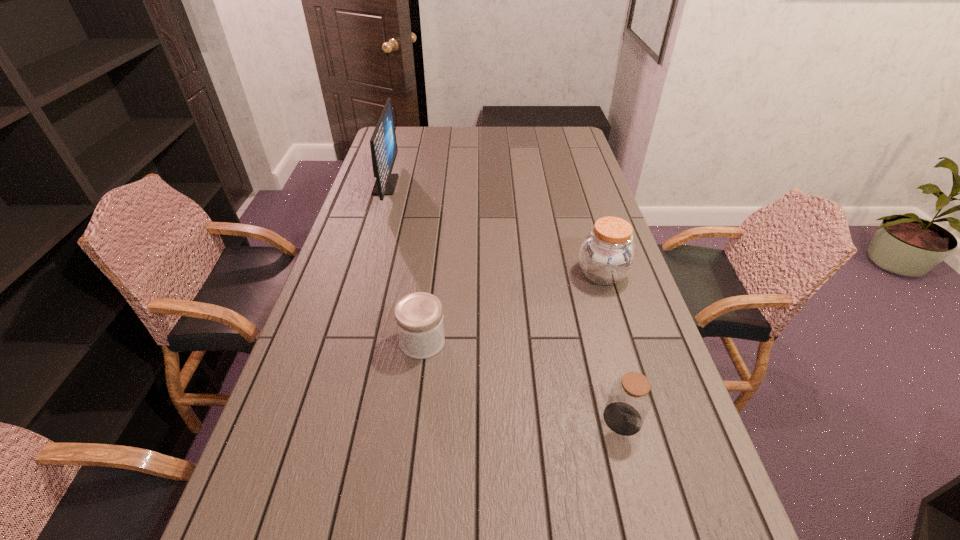
I want to click on blank space that satisfies the following two spatial constraints: 1. on the back side of the nearest object; 2. on the screen side of the leftmost object, so click(x=561, y=185).

This screenshot has height=540, width=960. I want to click on free point that satisfies the following two spatial constraints: 1. on the screen side of the farthest object; 2. on the back side of the leftmost jar, so click(338, 342).

This screenshot has width=960, height=540. Identify the location of blank area in the image that satisfies the following two spatial constraints: 1. on the screen side of the second nearest jar; 2. on the right side of the farthest object. (338, 342).

Where is `free point that satisfies the following two spatial constraints: 1. on the back side of the second farthest jar; 2. on the screen side of the tallest object`? free point that satisfies the following two spatial constraints: 1. on the back side of the second farthest jar; 2. on the screen side of the tallest object is located at coordinates (442, 185).

Identify the location of free space that satisfies the following two spatial constraints: 1. on the front side of the second nearest jar; 2. on the left side of the nearest object. Image resolution: width=960 pixels, height=540 pixels. (413, 418).

Locate an element on the screen. vacant space that satisfies the following two spatial constraints: 1. on the back side of the third object from right to left; 2. on the screen side of the tallest object is located at coordinates (442, 185).

The width and height of the screenshot is (960, 540). Find the location of `free location that satisfies the following two spatial constraints: 1. on the screen side of the farthest object; 2. on the left side of the third shortest object`. free location that satisfies the following two spatial constraints: 1. on the screen side of the farthest object; 2. on the left side of the third shortest object is located at coordinates (358, 274).

I want to click on vacant point that satisfies the following two spatial constraints: 1. on the screen side of the second tallest object; 2. on the left side of the computer monitor, so click(358, 274).

This screenshot has height=540, width=960. Identify the location of free point that satisfies the following two spatial constraints: 1. on the screen side of the leftmost object; 2. on the right side of the nearest jar. (314, 418).

The image size is (960, 540). I want to click on vacant space that satisfies the following two spatial constraints: 1. on the screen side of the nearest jar; 2. on the right side of the leftmost object, so click(314, 418).